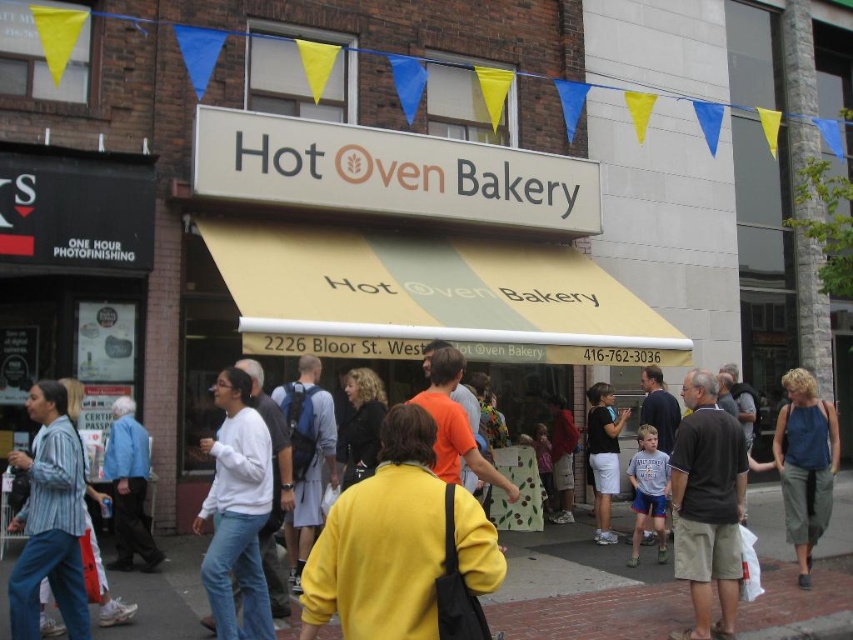
Between yellow fleece jacket at center and matte blue backpack at center, which one has less height?

Standing shorter between the two is yellow fleece jacket at center.

Is yellow fleece jacket at center wider than matte blue backpack at center?

Indeed, yellow fleece jacket at center has a greater width compared to matte blue backpack at center.

Is point (416, 429) positioned before point (314, 464)?

Yes, it is in front of point (314, 464).

Identify the location of yellow fleece jacket at center. Image resolution: width=853 pixels, height=640 pixels. (395, 541).

Is white matte sweater at center smaller than matte orange shirt at center?

Yes.

Is white matte sweater at center shorter than matte orange shirt at center?

Incorrect, white matte sweater at center's height does not fall short of matte orange shirt at center's.

Find the location of a particular element. white matte sweater at center is located at coordinates (236, 512).

Who is shorter, brick pavement at center or dark gray cotton shirt at center?

brick pavement at center

Does point (163, 588) lie behind point (712, 468)?

Yes, point (163, 588) is farther from viewer.

At what (x,y) coordinates should I click in order to perform the action: click on brick pavement at center. Please return your answer as a coordinate pair (x, y). Looking at the image, I should click on (582, 589).

Where is `brick pavement at center`? The width and height of the screenshot is (853, 640). brick pavement at center is located at coordinates (582, 589).